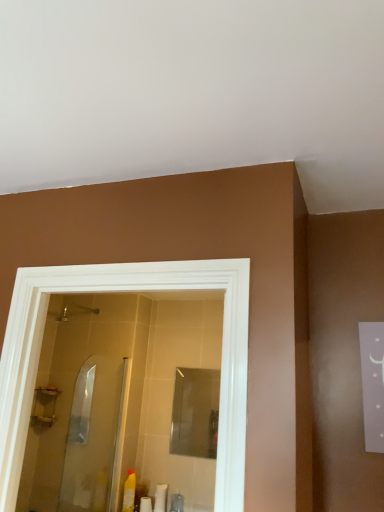
Question: Considering the relative positions of translucent plastic bottle at lower center, the first toiletry from the right, and brushed metal shower at upper left in the image provided, is translucent plastic bottle at lower center, the first toiletry from the right, to the right of brushed metal shower at upper left from the viewer's perspective?

Choices:
 (A) no
 (B) yes

Answer: (B)

Question: Does translucent plastic bottle at lower center, which is the third toiletry in left-to-right order, have a greater height compared to brushed metal shower at upper left?

Choices:
 (A) no
 (B) yes

Answer: (B)

Question: Can you confirm if translucent plastic bottle at lower center, which is the third toiletry in left-to-right order, is bigger than brushed metal shower at upper left?

Choices:
 (A) yes
 (B) no

Answer: (B)

Question: Is brushed metal shower at upper left a part of translucent plastic bottle at lower center, the first toiletry from the right?

Choices:
 (A) no
 (B) yes

Answer: (A)

Question: Is translucent plastic bottle at lower center, which is the third toiletry in left-to-right order, directly adjacent to brushed metal shower at upper left?

Choices:
 (A) no
 (B) yes

Answer: (A)

Question: Considering the positions of yellow plastic bottle at lower left, which is the first toiletry from left to right, and clear glass shower door at center in the image, is yellow plastic bottle at lower left, which is the first toiletry from left to right, bigger or smaller than clear glass shower door at center?

Choices:
 (A) small
 (B) big

Answer: (A)

Question: Considering their positions, is yellow plastic bottle at lower left, which is the third toiletry from right to left, located in front of or behind clear glass shower door at center?

Choices:
 (A) front
 (B) behind

Answer: (B)

Question: Considering the positions of yellow plastic bottle at lower left, which is the third toiletry from right to left, and clear glass shower door at center in the image, is yellow plastic bottle at lower left, which is the third toiletry from right to left, taller or shorter than clear glass shower door at center?

Choices:
 (A) tall
 (B) short

Answer: (B)

Question: From the image's perspective, is yellow plastic bottle at lower left, which is the first toiletry from left to right, located above or below clear glass shower door at center?

Choices:
 (A) above
 (B) below

Answer: (B)

Question: In the image, is clear glass shower door at center positioned in front of or behind brushed metal shower at upper left?

Choices:
 (A) front
 (B) behind

Answer: (A)

Question: Is clear glass shower door at center inside or outside of brushed metal shower at upper left?

Choices:
 (A) outside
 (B) inside

Answer: (A)

Question: In terms of width, does clear glass shower door at center look wider or thinner when compared to brushed metal shower at upper left?

Choices:
 (A) wide
 (B) thin

Answer: (B)

Question: Looking at the image, does clear glass shower door at center seem bigger or smaller compared to brushed metal shower at upper left?

Choices:
 (A) big
 (B) small

Answer: (A)

Question: Is translucent plastic bottle at lower center, which is the third toiletry in left-to-right order, taller or shorter than clear glass shower door at center?

Choices:
 (A) tall
 (B) short

Answer: (B)

Question: From a real-world perspective, is translucent plastic bottle at lower center, which is the third toiletry in left-to-right order, above or below clear glass shower door at center?

Choices:
 (A) below
 (B) above

Answer: (A)